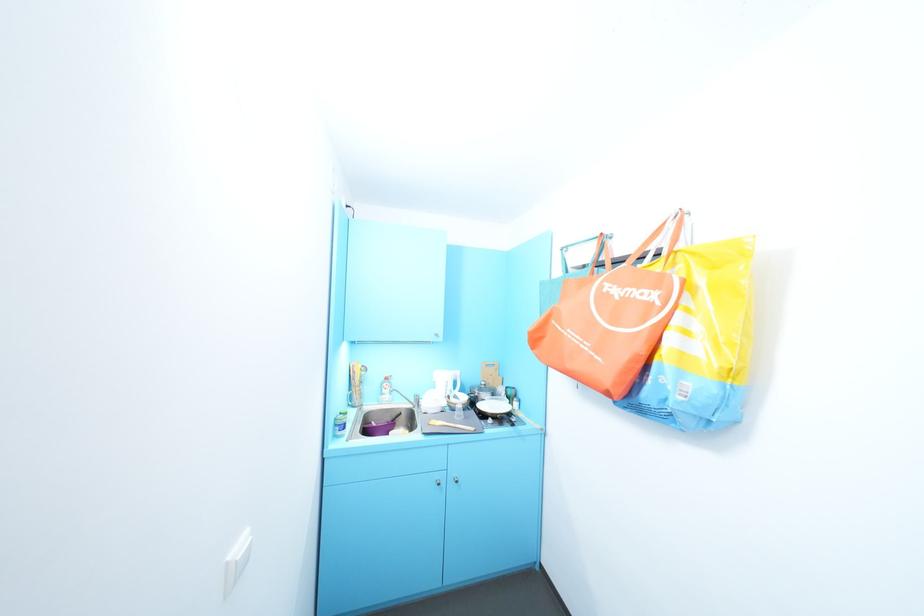
Find where to lift the pan handle. Please return your answer as a coordinate pair (x, y).

(380, 427)